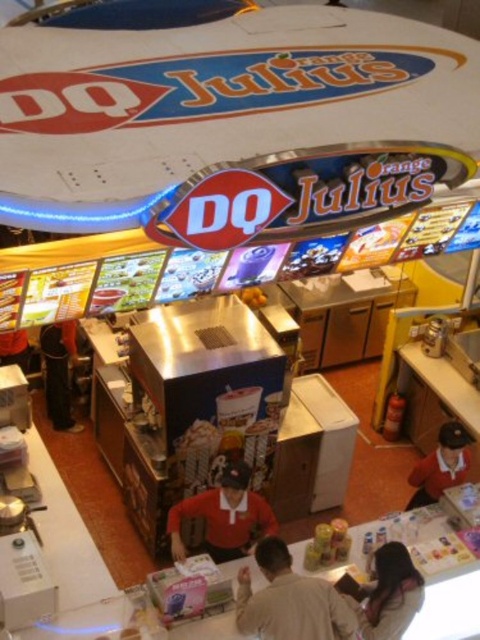
Image resolution: width=480 pixels, height=640 pixels. What do you see at coordinates (388, 595) in the screenshot?
I see `matte white shirt at lower right` at bounding box center [388, 595].

Which is more to the right, matte white shirt at lower right or white fabric shirt at lower right?

white fabric shirt at lower right

The width and height of the screenshot is (480, 640). What do you see at coordinates (388, 595) in the screenshot?
I see `matte white shirt at lower right` at bounding box center [388, 595].

Locate an element on the screen. This screenshot has width=480, height=640. matte white shirt at lower right is located at coordinates (388, 595).

Based on the photo, can you confirm if light brown shirt at center is positioned above red smooth uniform at center?

No.

Does point (271, 564) come in front of point (252, 516)?

Yes.

Find the location of a particular element. Image resolution: width=480 pixels, height=640 pixels. light brown shirt at center is located at coordinates (289, 600).

Does light brown shirt at center appear under matte white shirt at lower right?

Actually, light brown shirt at center is above matte white shirt at lower right.

Is light brown shirt at center to the left of matte white shirt at lower right from the viewer's perspective?

Indeed, light brown shirt at center is positioned on the left side of matte white shirt at lower right.

What are the coordinates of `light brown shirt at center` in the screenshot? It's located at (289, 600).

Find the location of a particular element. This screenshot has width=480, height=640. light brown shirt at center is located at coordinates (289, 600).